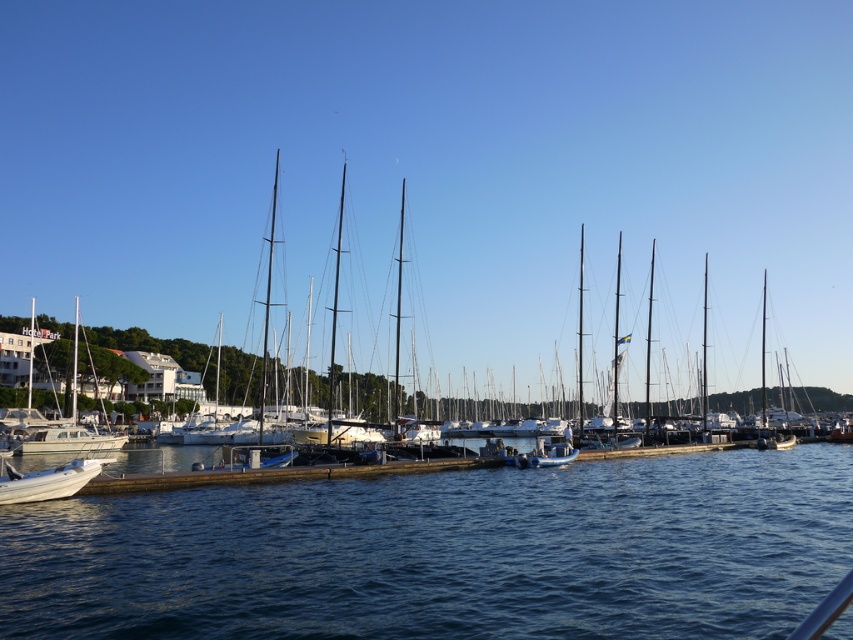
Does white matte boat at lower left appear on the right side of blue rubber dinghy at center?

No, white matte boat at lower left is not to the right of blue rubber dinghy at center.

Is point (22, 474) closer to camera compared to point (535, 461)?

Yes, it is.

Locate an element on the screen. white matte boat at lower left is located at coordinates (47, 481).

Who is taller, white glossy sailboat at left or blue rubber dinghy at center?

With more height is white glossy sailboat at left.

Who is lower down, white glossy sailboat at left or blue rubber dinghy at center?

blue rubber dinghy at center is lower down.

Identify the location of white glossy sailboat at left. The height and width of the screenshot is (640, 853). (73, 444).

Image resolution: width=853 pixels, height=640 pixels. In order to click on white glossy sailboat at left in this screenshot , I will do `click(73, 444)`.

Which is more to the right, blue water at lower center or white matte boat at lower left?

From the viewer's perspective, blue water at lower center appears more on the right side.

Consider the image. Can you confirm if blue water at lower center is positioned below white matte boat at lower left?

Yes, blue water at lower center is below white matte boat at lower left.

Who is more forward, (x=660, y=481) or (x=15, y=476)?

Positioned in front is point (x=15, y=476).

Image resolution: width=853 pixels, height=640 pixels. Find the location of `blue water at lower center`. blue water at lower center is located at coordinates coord(445,552).